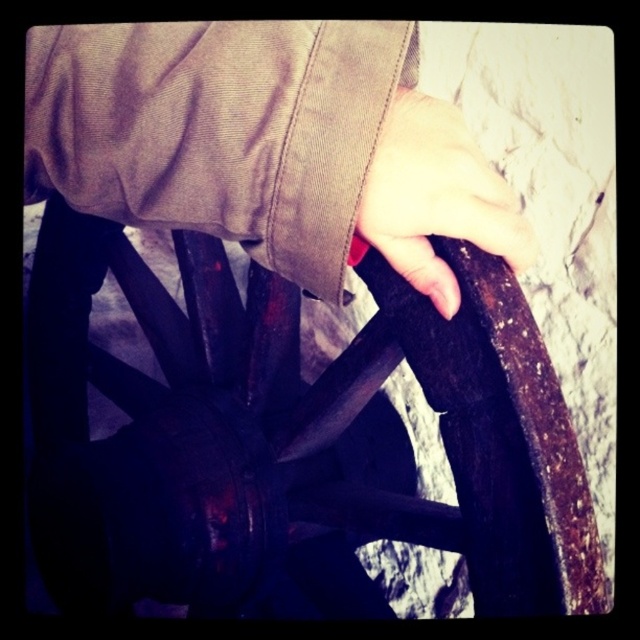
What do you see at coordinates (300, 426) in the screenshot? The width and height of the screenshot is (640, 640). I see `rusty metal wagon wheel at center` at bounding box center [300, 426].

Which is more to the left, rusty metal wagon wheel at center or brown suede jacket at upper center?

From the viewer's perspective, rusty metal wagon wheel at center appears more on the left side.

Between point (468, 352) and point (362, 35), which one is positioned behind?

Point (468, 352)

Locate an element on the screen. Image resolution: width=640 pixels, height=640 pixels. rusty metal wagon wheel at center is located at coordinates (300, 426).

Which of these two, rusty metal wagon wheel at center or smooth skin hand at center, stands shorter?

With less height is smooth skin hand at center.

Does rusty metal wagon wheel at center have a greater width compared to smooth skin hand at center?

Yes.

What do you see at coordinates (300, 426) in the screenshot? This screenshot has height=640, width=640. I see `rusty metal wagon wheel at center` at bounding box center [300, 426].

Locate an element on the screen. This screenshot has height=640, width=640. rusty metal wagon wheel at center is located at coordinates (300, 426).

Does brown suede jacket at upper center appear under smooth skin hand at center?

Actually, brown suede jacket at upper center is above smooth skin hand at center.

Which is behind, point (516, 246) or point (422, 120)?

Positioned behind is point (516, 246).

I want to click on brown suede jacket at upper center, so pyautogui.click(x=266, y=144).